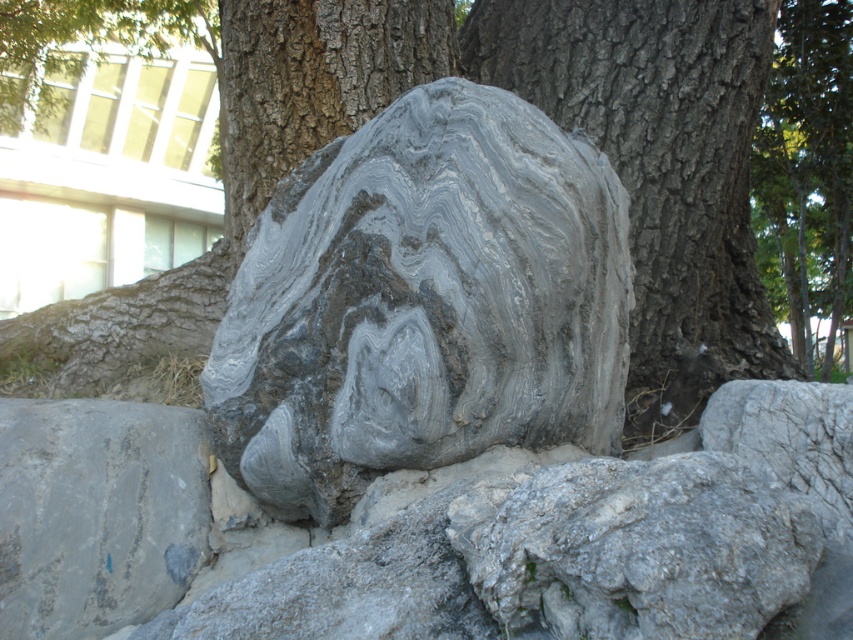
Is point (625, 320) in front of point (9, 625)?

No.

How much distance is there between marble sculpture at center and gray/rough stone at lower left?

They are 18.24 inches apart.

Image resolution: width=853 pixels, height=640 pixels. What do you see at coordinates (422, 304) in the screenshot? I see `marble sculpture at center` at bounding box center [422, 304].

At what (x,y) coordinates should I click in order to perform the action: click on marble sculpture at center. Please return your answer as a coordinate pair (x, y). Image resolution: width=853 pixels, height=640 pixels. Looking at the image, I should click on (422, 304).

Image resolution: width=853 pixels, height=640 pixels. Identify the location of gray rough rock at center. (636, 548).

Is point (798, 570) in front of point (38, 436)?

Yes, point (798, 570) is in front of point (38, 436).

Locate an element on the screen. gray rough rock at center is located at coordinates (636, 548).

Based on the photo, can you confirm if marble sculpture at center is wider than gray rough rock at center?

Yes, marble sculpture at center is wider than gray rough rock at center.

Does marble sculpture at center come behind gray rough rock at center?

Yes.

Is point (496, 380) less distant than point (758, 579)?

No, (496, 380) is further to viewer.

Find the location of `marble sculpture at center`. marble sculpture at center is located at coordinates (422, 304).